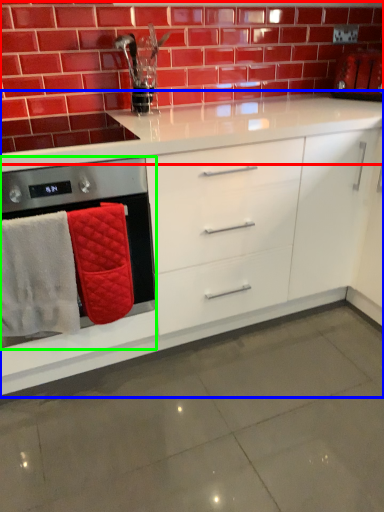
Question: Estimate the real-world distances between objects in this image. Which object is closer to brickwork (highlighted by a red box), cabinetry (highlighted by a blue box) or home appliance (highlighted by a green box)?

Choices:
 (A) cabinetry
 (B) home appliance

Answer: (B)